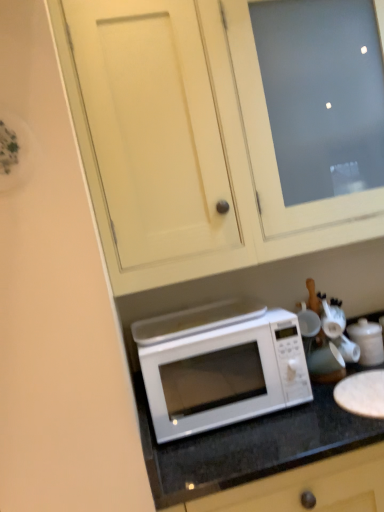
The width and height of the screenshot is (384, 512). In order to click on vacant space situated above white matte microwave at center (from a real-world perspective) in this screenshot , I will do `click(180, 318)`.